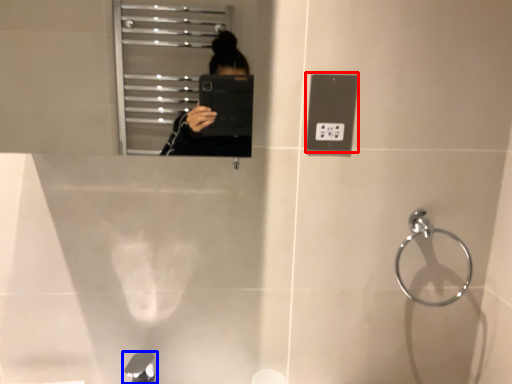
Question: Which object is further to the camera taking this photo, light switch (highlighted by a red box) or tap (highlighted by a blue box)?

Choices:
 (A) light switch
 (B) tap

Answer: (A)